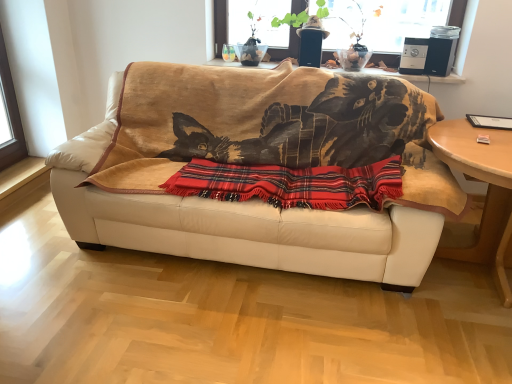
Where is `free space in front of leather couch at center`? free space in front of leather couch at center is located at coordinates (239, 331).